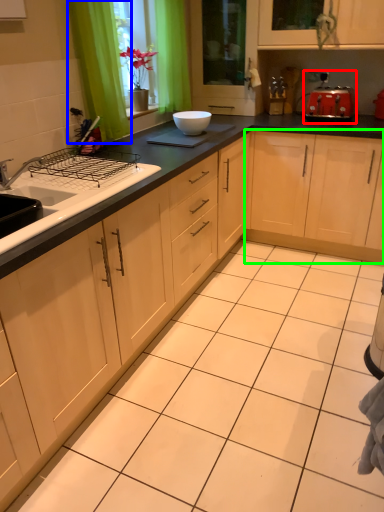
Question: Which object is positioned closest to appliance (highlighted by a red box)? Select from curtain (highlighted by a blue box) and cabinetry (highlighted by a green box).

Choices:
 (A) curtain
 (B) cabinetry

Answer: (B)